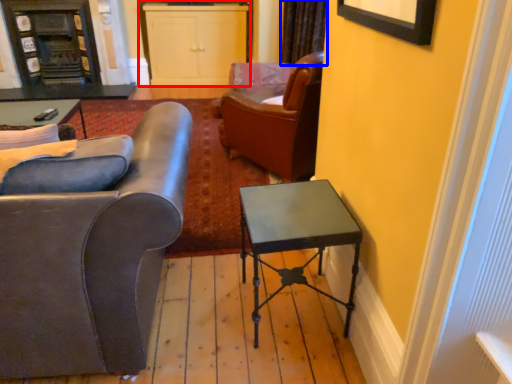
Question: Which of the following is the closest to the observer, cabinetry (highlighted by a red box) or curtain (highlighted by a blue box)?

Choices:
 (A) cabinetry
 (B) curtain

Answer: (B)